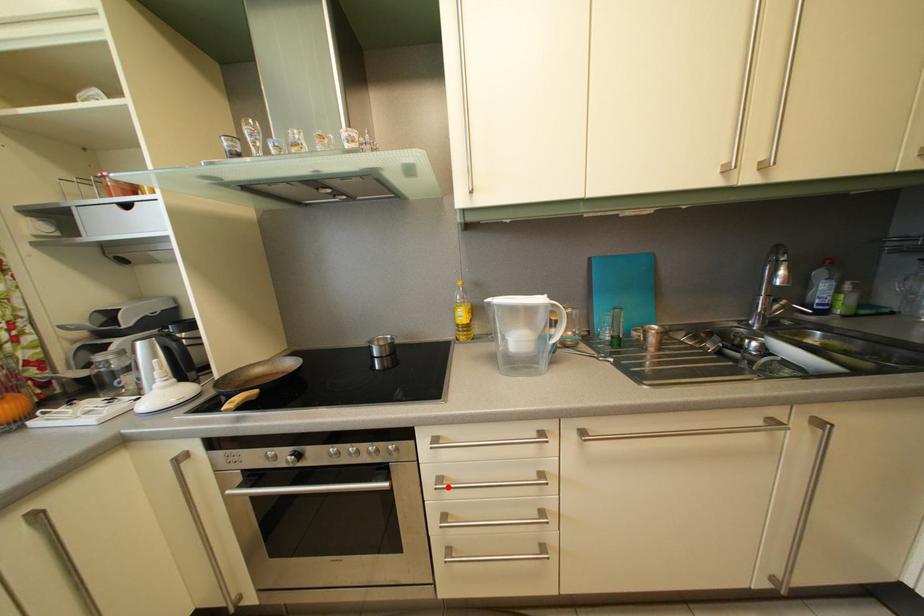
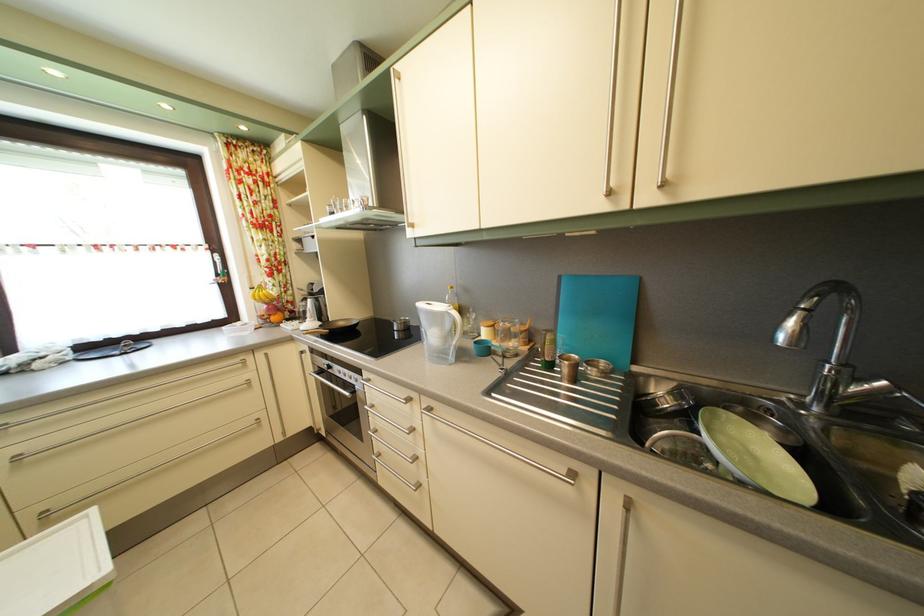
In the second image, find the point that corresponds to the highlighted location in the first image.

(381, 414)